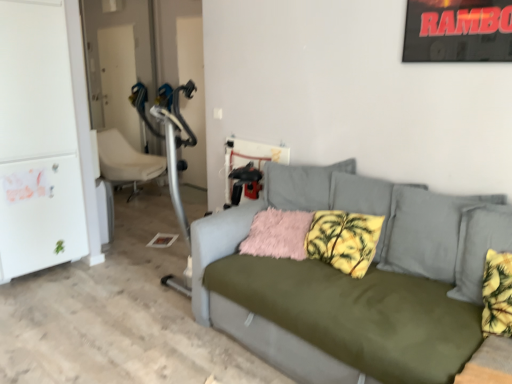
Question: Considering the positions of point (126, 175) and point (266, 233), is point (126, 175) closer or farther from the camera than point (266, 233)?

Choices:
 (A) farther
 (B) closer

Answer: (A)

Question: In terms of size, does white plastic chair at left appear bigger or smaller than fuzzy pink pillow at center, the second pillow when ordered from right to left?

Choices:
 (A) small
 (B) big

Answer: (B)

Question: Based on their relative distances, which object is nearer to the white plastic chair at left?

Choices:
 (A) yellow palm-patterned pillow at center, the 2th pillow from the left
 (B) olive green fabric couch at center
 (C) white matte refrigerator at left
 (D) fuzzy pink pillow at center, the second pillow when ordered from right to left

Answer: (C)

Question: Estimate the real-world distances between objects in this image. Which object is farther from the yellow palm-patterned pillow at center, arranged as the first pillow when viewed from the right?

Choices:
 (A) fuzzy pink pillow at center, which is the 1th pillow in left-to-right order
 (B) olive green fabric couch at center
 (C) white plastic chair at left
 (D) white matte refrigerator at left

Answer: (C)